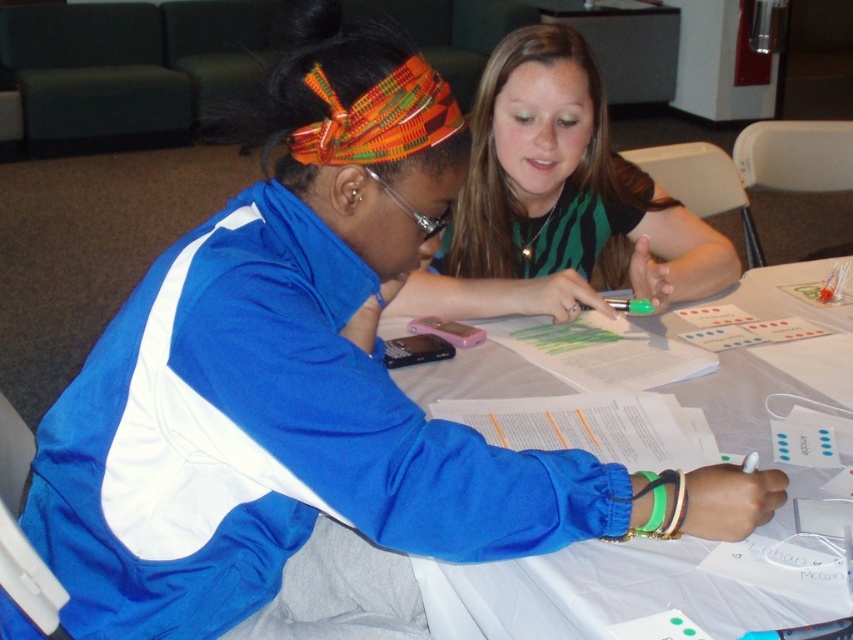
From the picture: You are a photographer standing behind the two people in the scene. You want to take a photo of the white paper at center without including the green striped shirt at upper center in the frame. Is this possible given their relative sizes?

The green striped shirt at upper center is not as tall as the white paper at center, so it is possible to position the camera to capture the white paper at center while excluding the green striped shirt at upper center from the frame.

You are standing at the position of the person on the right. Looking at the paper, which point is closer to you between point (x=534, y=291) and point (x=759, y=392)?

Point (x=759, y=392) is closer to you because it is in front of point (x=534, y=291).

You are an observer looking at the scene. You see the green striped shirt at upper center and the white paper at center. Which object is closer to the top of the image?

The green striped shirt at upper center is positioned over the white paper at center, so it is closer to the top of the image.